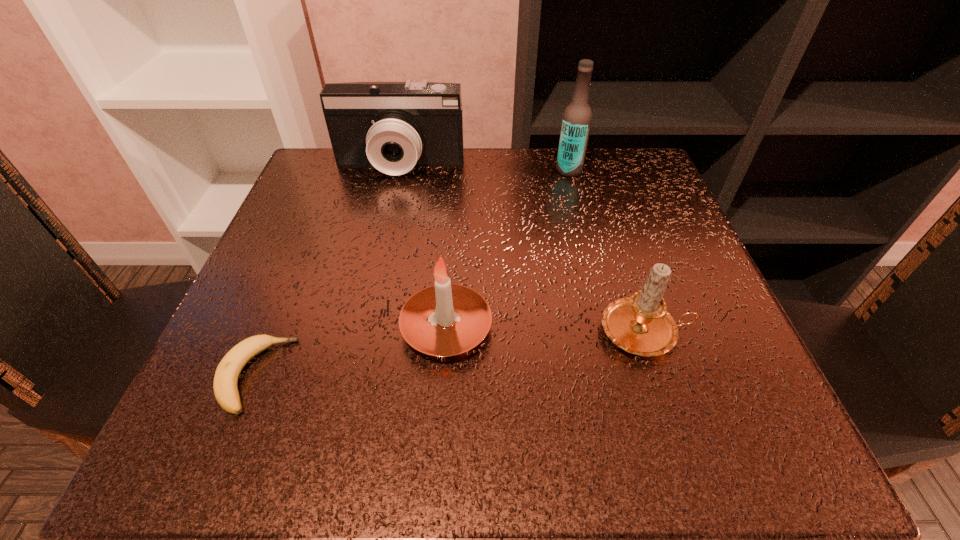
Find the location of a particular element. The image size is (960, 540). object located in the near left corner section of the desktop is located at coordinates (225, 387).

You are a GUI agent. You are given a task and a screenshot of the screen. Output one action in this format:
    pyautogui.click(x=<x>, y=<y>)
    Task: Click on the object present at the far right corner
    
    Given the screenshot: What is the action you would take?
    pyautogui.click(x=577, y=118)

Find the location of a particular element. The image size is (960, 540). vacant space at the far edge of the desktop is located at coordinates (534, 204).

Where is `vacant space at the near edge`? The height and width of the screenshot is (540, 960). vacant space at the near edge is located at coordinates (492, 441).

The height and width of the screenshot is (540, 960). Identify the location of vacant space at the left edge. (236, 314).

Locate an element on the screen. vacant space at the right edge is located at coordinates (712, 295).

The height and width of the screenshot is (540, 960). In order to click on vacant region at the far left corner of the desktop in this screenshot , I will do `click(328, 154)`.

Locate an element on the screen. free space at the near left corner is located at coordinates (228, 417).

Find the location of a particular element. This screenshot has height=540, width=960. vacant space at the far right corner of the desktop is located at coordinates (617, 164).

I want to click on vacant space at the near right corner of the desktop, so [717, 447].